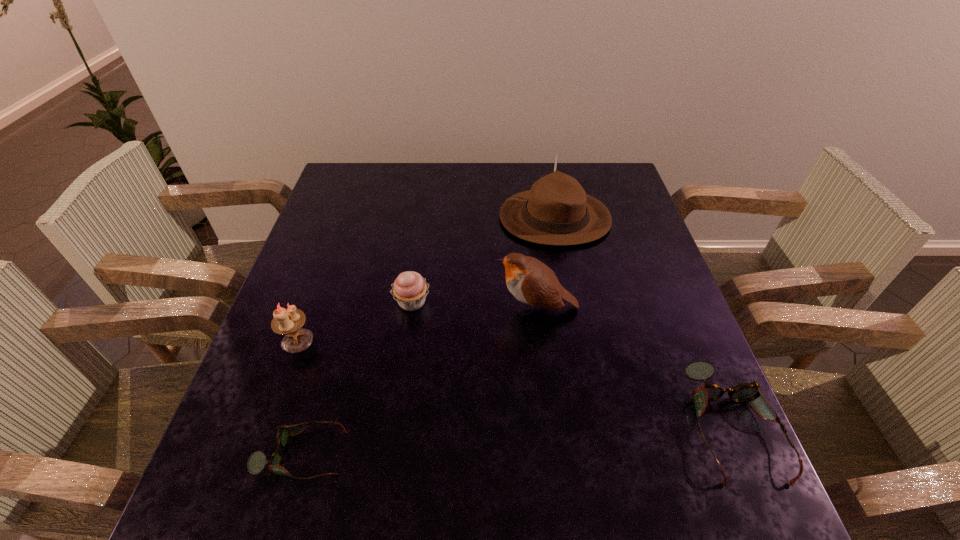
At what (x,y) coordinates should I click in order to perform the action: click on the shorter spectacles. Please return your answer as a coordinate pair (x, y). This screenshot has height=540, width=960. Looking at the image, I should click on (257, 461).

Identify the location of the shortest object. The width and height of the screenshot is (960, 540). click(257, 461).

Locate an element on the screen. the right spectacles is located at coordinates (699, 370).

Find the location of a particular element. the rightmost object is located at coordinates (699, 370).

Find the location of `fedora`. fedora is located at coordinates (556, 211).

Find the location of a particular element. The height and width of the screenshot is (540, 960). candle holder is located at coordinates (289, 322).

At what (x,y) coordinates should I click in order to perform the action: click on the fourth object from right to left. Please return your answer as a coordinate pair (x, y). Looking at the image, I should click on (410, 289).

Identify the location of the fourth tallest object. (410, 289).

The height and width of the screenshot is (540, 960). Identify the location of bird. (530, 281).

This screenshot has height=540, width=960. I want to click on vacant region located 0.110m on the front-facing side of the shorter spectacles, so click(405, 454).